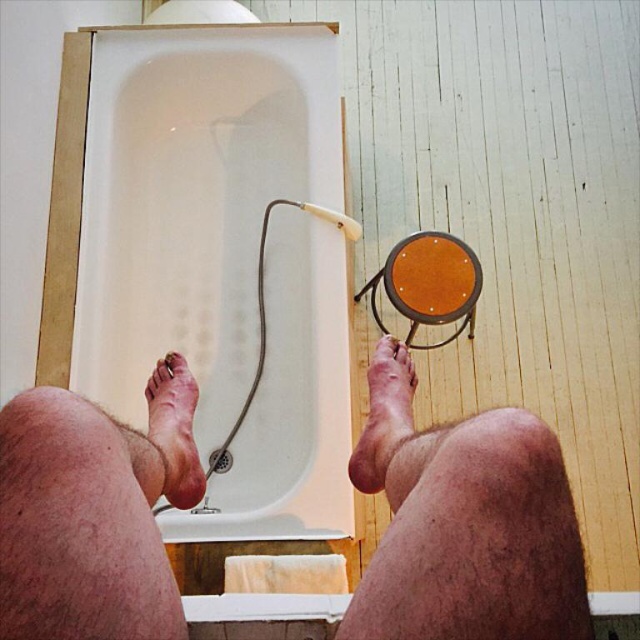
Can you confirm if dry skin foot at lower left is positioned to the left of dry skin foot at lower center?

Indeed, dry skin foot at lower left is positioned on the left side of dry skin foot at lower center.

Is dry skin foot at lower left smaller than dry skin foot at lower center?

Actually, dry skin foot at lower left might be larger than dry skin foot at lower center.

Does point (188, 417) come in front of point (380, 355)?

Yes, point (188, 417) is in front of point (380, 355).

This screenshot has width=640, height=640. I want to click on dry skin foot at lower left, so click(x=173, y=429).

Looking at this image, who is higher up, white glossy bathtub at lower left or dry skin foot at lower left?

white glossy bathtub at lower left is higher up.

Does point (122, 248) lie behind point (177, 500)?

Yes.

Locate an element on the screen. The image size is (640, 640). white glossy bathtub at lower left is located at coordinates (193, 198).

Is white glossy bathtub at lower left closer to camera compared to hairy skin at lower center?

No, white glossy bathtub at lower left is behind hairy skin at lower center.

Can you confirm if white glossy bathtub at lower left is smaller than hairy skin at lower center?

Incorrect, white glossy bathtub at lower left is not smaller in size than hairy skin at lower center.

Between point (292, 22) and point (369, 627), which one is positioned behind?

The point (292, 22) is behind.

The image size is (640, 640). Identify the location of white glossy bathtub at lower left. (193, 198).